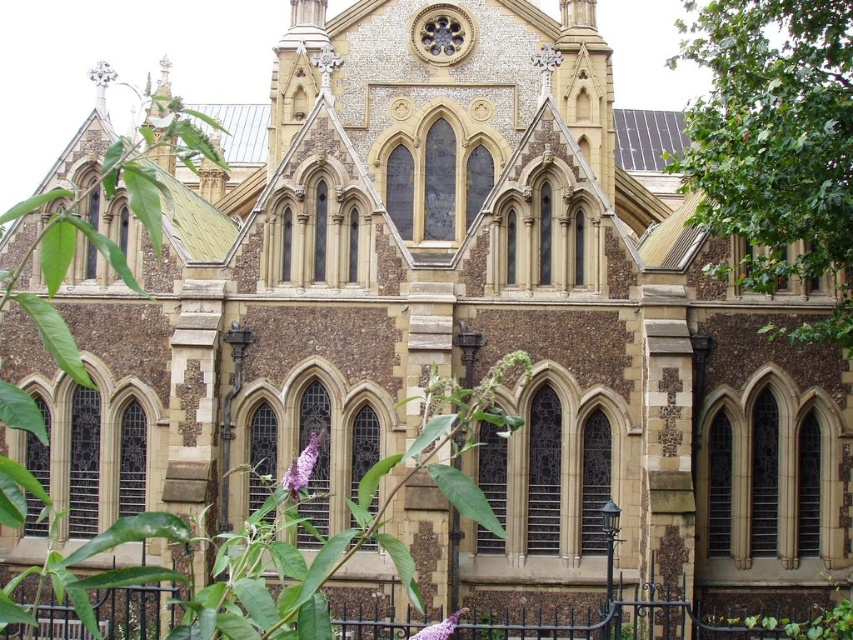
You are standing in front of the grand historic building and want to take a photo of the green leafy tree at right. Where should you position yourself to capture the tree in the frame?

The green leafy tree at right is located at point (775, 145), so you should position yourself to the right side of the building to include the tree in your photo.

You are standing in front of the historic building and want to place a decorative stone statue on the ground. You have two options for placement locations near the green leafy tree at right and the purple matte flower at center. Which location would be closer to the base of the building?

The purple matte flower at center is closer to the base of the building because the green leafy tree at right is positioned over it, indicating it is further away.

You are standing in front of the grand historic building and want to take a photo that includes both the green leafy tree at right and the purple matte flower at lower center. Which object should you adjust your camera angle to focus on first to ensure both are in frame?

You should focus on the green leafy tree at right first because it is closer to you than the purple matte flower at lower center, so adjusting for its position ensures the flower will also be in frame.